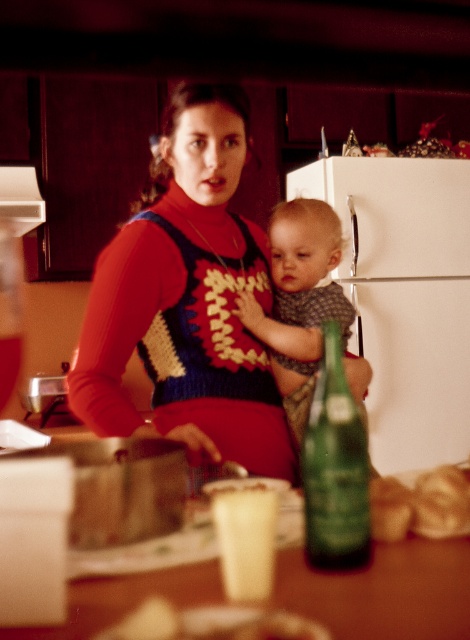
Which is above, white matte refrigerator at center or wooden table at center?

white matte refrigerator at center is above.

Is white matte refrigerator at center to the left of wooden table at center from the viewer's perspective?

No, white matte refrigerator at center is not to the left of wooden table at center.

Identify the location of white matte refrigerator at center. Image resolution: width=470 pixels, height=640 pixels. (406, 296).

I want to click on white matte refrigerator at center, so click(406, 296).

Does wooden table at center have a smaller size compared to soft gray knit sweater at center?

Yes, wooden table at center is smaller than soft gray knit sweater at center.

Who is more forward, (x=435, y=570) or (x=291, y=216)?

Point (x=435, y=570) is in front.

Where is `wooden table at center`? wooden table at center is located at coordinates (383, 592).

Who is taller, crochet sweater at center or white matte refrigerator at center?

With more height is white matte refrigerator at center.

This screenshot has width=470, height=640. In order to click on crochet sweater at center in this screenshot , I will do `click(187, 300)`.